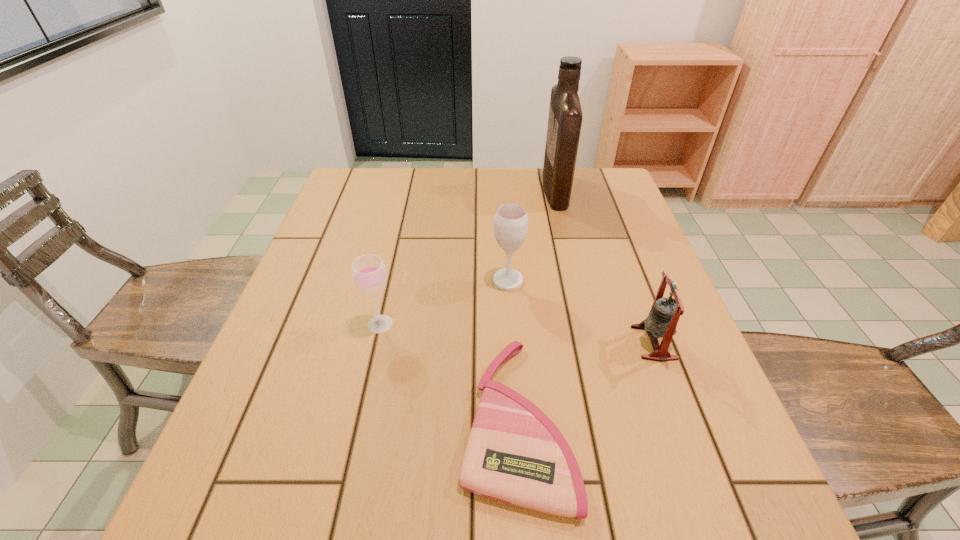
Find the location of a particular element. vacant space at the left edge of the desktop is located at coordinates (325, 244).

Where is `vacant space at the right edge of the desktop`? This screenshot has width=960, height=540. vacant space at the right edge of the desktop is located at coordinates (686, 330).

In the image, there is a desktop. In order to click on free space at the far left corner in this screenshot , I will do [342, 176].

This screenshot has width=960, height=540. I want to click on free spot at the far right corner of the desktop, so click(583, 176).

Where is `free area in between the wristlet and the shorter wineglass`? This screenshot has width=960, height=540. free area in between the wristlet and the shorter wineglass is located at coordinates (447, 372).

You are a GUI agent. You are given a task and a screenshot of the screen. Output one action in this format:
    pyautogui.click(x=<x>, y=<y>)
    Task: Click on the empty location between the bell and the wristlet
    Image resolution: width=960 pixels, height=540 pixels.
    Given the screenshot: What is the action you would take?
    pyautogui.click(x=585, y=381)

The image size is (960, 540). In order to click on free space between the leftmost object and the farther wineglass in this screenshot , I will do `click(444, 302)`.

The width and height of the screenshot is (960, 540). I want to click on free space between the second object from right to left and the wristlet, so click(x=536, y=305).

In order to click on free space between the farthest object and the right wineglass in this screenshot , I will do `click(532, 235)`.

Locate an element on the screen. The width and height of the screenshot is (960, 540). free space that is in between the tallest object and the wristlet is located at coordinates (536, 305).